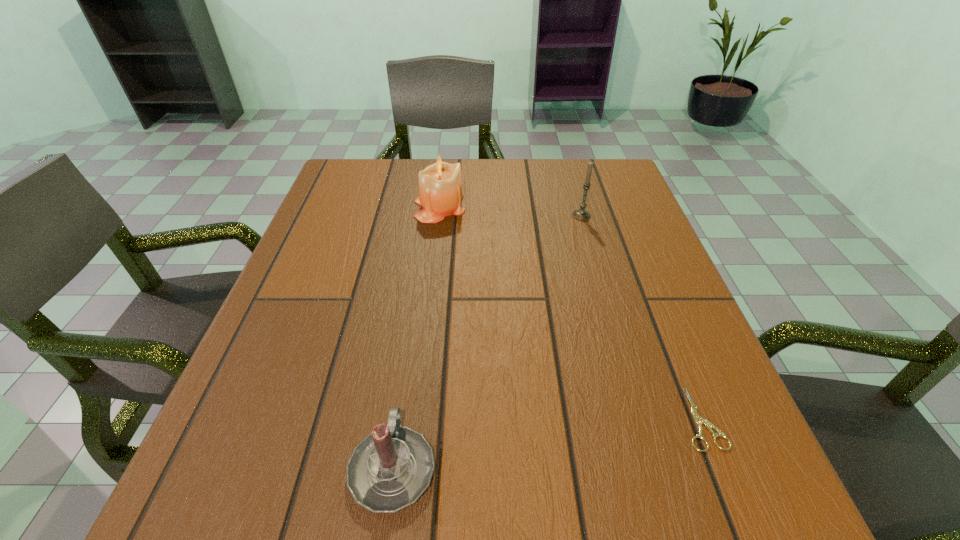
Image resolution: width=960 pixels, height=540 pixels. Find the location of `free spot between the third object from left to right and the nearest candle`. free spot between the third object from left to right and the nearest candle is located at coordinates (487, 341).

Where is `free spot between the third object from left to right and the nearest candle`? This screenshot has height=540, width=960. free spot between the third object from left to right and the nearest candle is located at coordinates (487, 341).

You are a GUI agent. You are given a task and a screenshot of the screen. Output one action in this format:
    pyautogui.click(x=<x>, y=<y>)
    Task: Click on the vacant point located between the rightmost candle and the shears
    The image size is (960, 540).
    Given the screenshot: What is the action you would take?
    pyautogui.click(x=641, y=317)

Select which object appears as the third closest to the second shortest object. Please provide its 2D coordinates. Your answer should be formatted as a tuple, i.e. [(x, y)], where the tuple contains the x and y coordinates of a point satisfying the conditions above.

[(580, 214)]

Identify which object is the nearest to the second object from right to left. Please provide its 2D coordinates. Your answer should be formatted as a tuple, i.e. [(x, y)], where the tuple contains the x and y coordinates of a point satisfying the conditions above.

[(440, 187)]

Find the location of a particular element. This screenshot has height=540, width=960. the closest candle relative to the rightmost candle is located at coordinates (440, 187).

Locate which candle ranks second in proximity to the nearest candle. Please provide its 2D coordinates. Your answer should be formatted as a tuple, i.e. [(x, y)], where the tuple contains the x and y coordinates of a point satisfying the conditions above.

[(580, 214)]

Image resolution: width=960 pixels, height=540 pixels. What are the coordinates of `free space that satisfies the following two spatial constraints: 1. on the side of the shortest candle with the handle loop; 2. on the right side of the shears` in the screenshot? It's located at point(400,418).